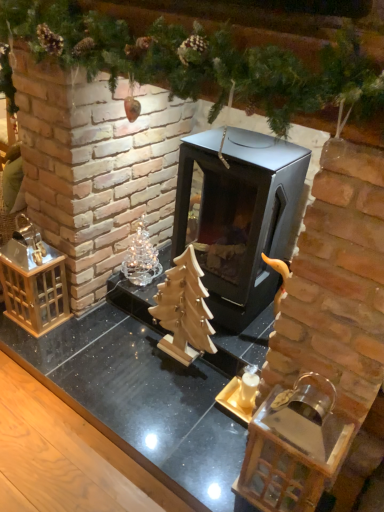
This screenshot has height=512, width=384. In order to click on free space above black metal fireplace at center (from a real-world perspective) in this screenshot , I will do `click(248, 139)`.